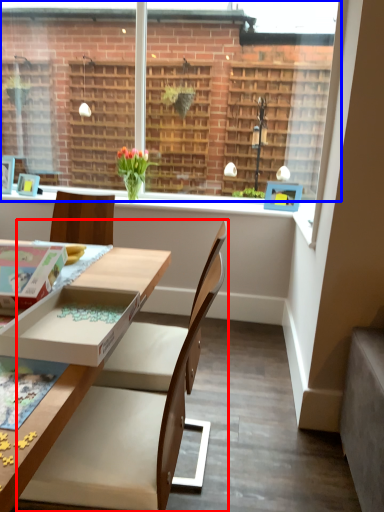
Question: Among these objects, which one is nearest to the camera, chair (highlighted by a red box) or window (highlighted by a blue box)?

Choices:
 (A) chair
 (B) window

Answer: (A)